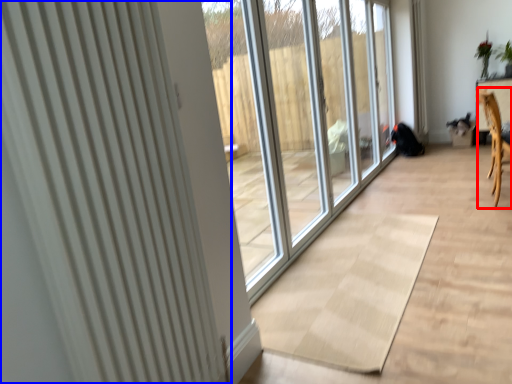
Question: Which object appears farthest to the camera in this image, armchair (highlighted by a red box) or radiator (highlighted by a blue box)?

Choices:
 (A) armchair
 (B) radiator

Answer: (A)